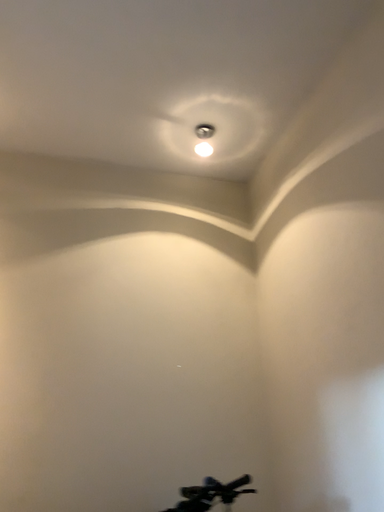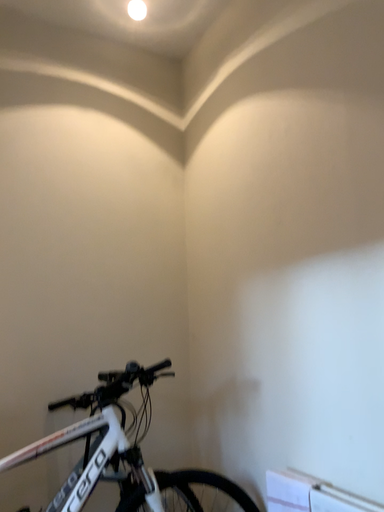
Question: How did the camera likely rotate when shooting the video?

Choices:
 (A) rotated upward
 (B) rotated downward

Answer: (B)